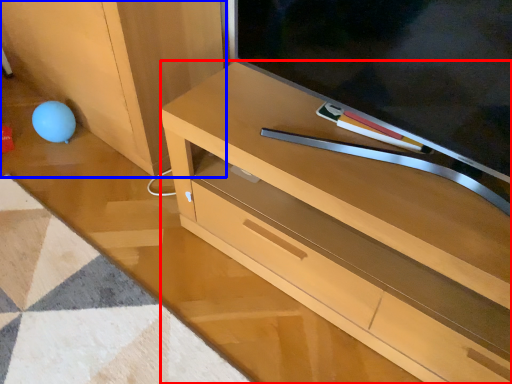
Question: Among these objects, which one is farthest to the camera, desk (highlighted by a red box) or cabinetry (highlighted by a blue box)?

Choices:
 (A) desk
 (B) cabinetry

Answer: (B)